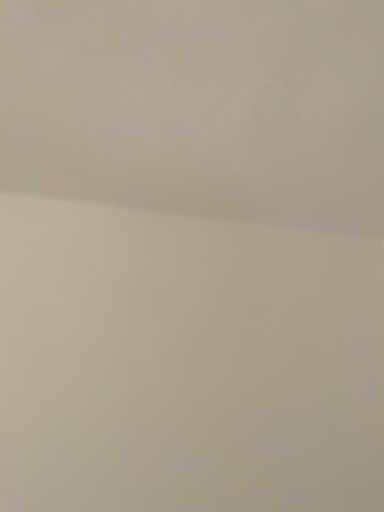
What do you see at coordinates (199, 106) in the screenshot? The image size is (384, 512). I see `smooth matte wall at upper center` at bounding box center [199, 106].

At what (x,y) coordinates should I click in order to perform the action: click on smooth matte wall at upper center. Please return your answer as a coordinate pair (x, y). Image resolution: width=384 pixels, height=512 pixels. Looking at the image, I should click on click(x=199, y=106).

What is the approximate height of smooth matte wall at upper center?

smooth matte wall at upper center is 2.97 inches tall.

This screenshot has width=384, height=512. In order to click on smooth matte wall at upper center in this screenshot , I will do `click(199, 106)`.